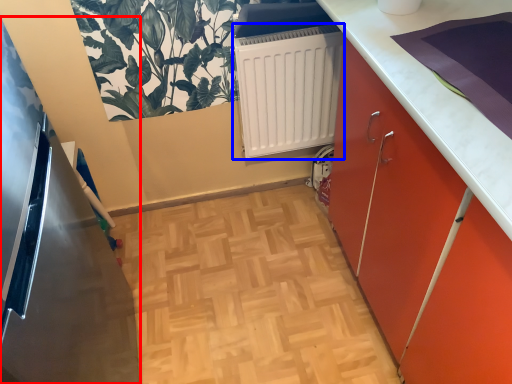
Question: Which object is further to the camera taking this photo, appliance (highlighted by a red box) or radiator (highlighted by a blue box)?

Choices:
 (A) appliance
 (B) radiator

Answer: (B)